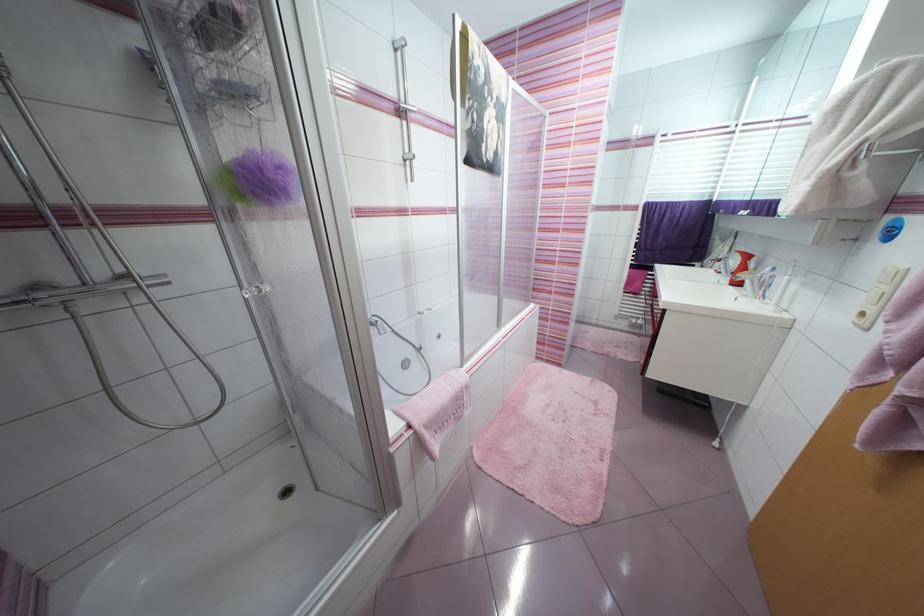
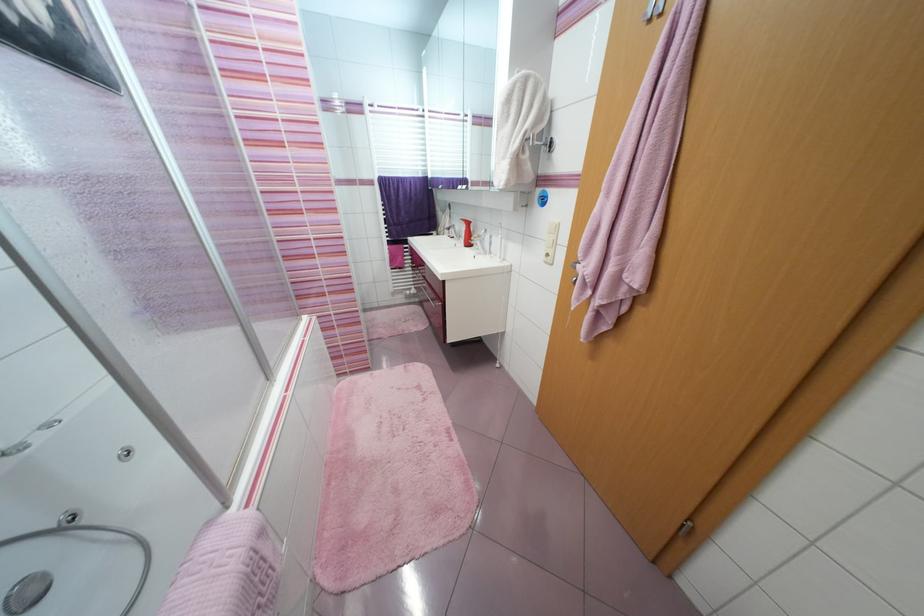
Question: The camera is either moving clockwise (left) or counter-clockwise (right) around the object. The first image is from the beginning of the video and the second image is from the end. Is the camera moving left or right when shooting the video?

Choices:
 (A) Left
 (B) Right

Answer: (A)